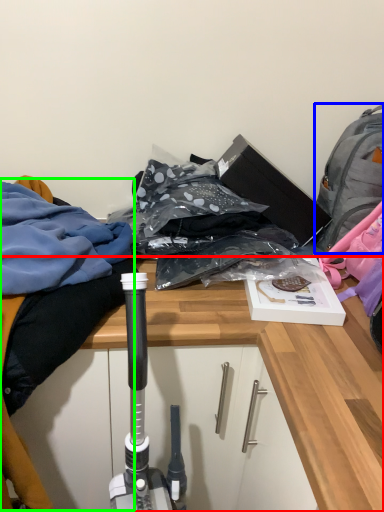
Question: Based on their relative distances, which object is nearer to desk (highlighted by a red box)? Choose from backpack (highlighted by a blue box) and clothing (highlighted by a green box).

Choices:
 (A) backpack
 (B) clothing

Answer: (B)